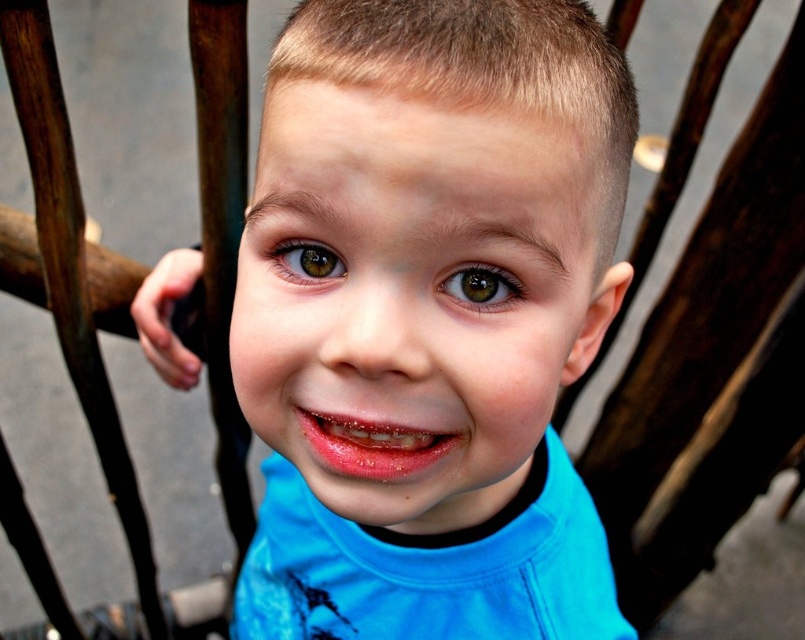
Looking at the child in the image, where are the shiny pink lips at center in relation to the brown glossy eye at center?

The shiny pink lips at center are to the right of the brown glossy eye at center.

You are a photographer setting up a shoot. You notice the blue fabric shirt at center and the wooden chair at center in the scene. Based on their positions, which object is closer to the camera?

The blue fabric shirt at center is located above the wooden chair at center, so it is closer to the camera.